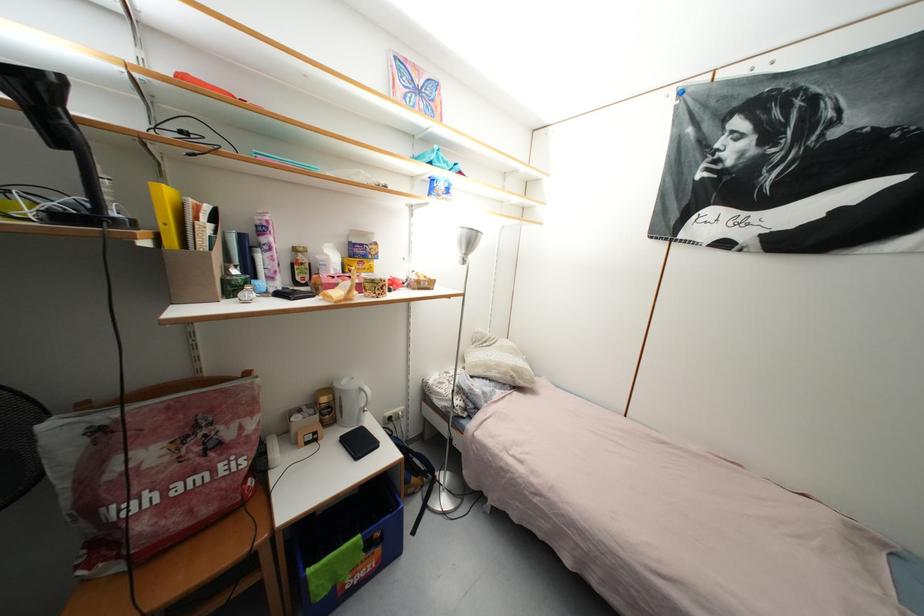
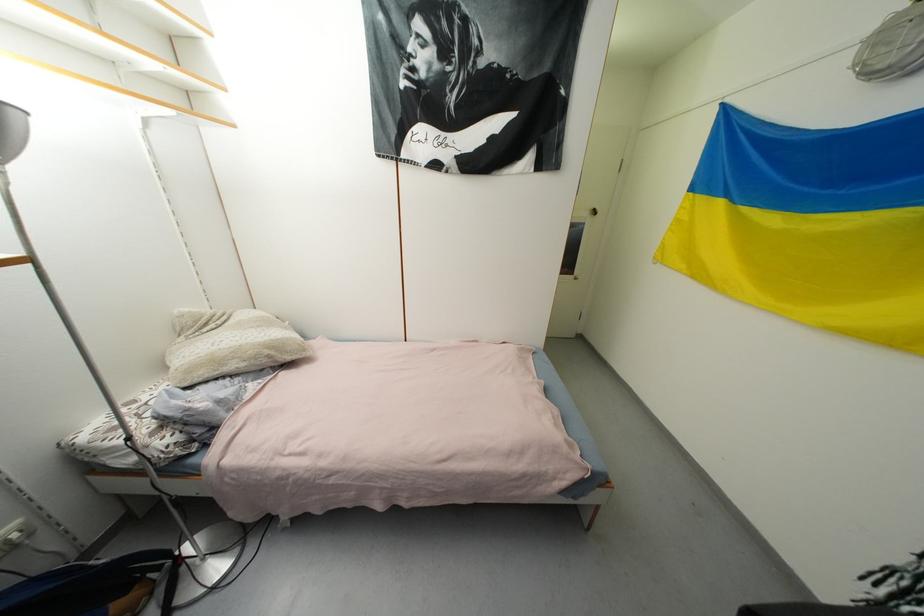
Find the pixel in the second image that matches pixel 511 376 in the first image.

(261, 359)